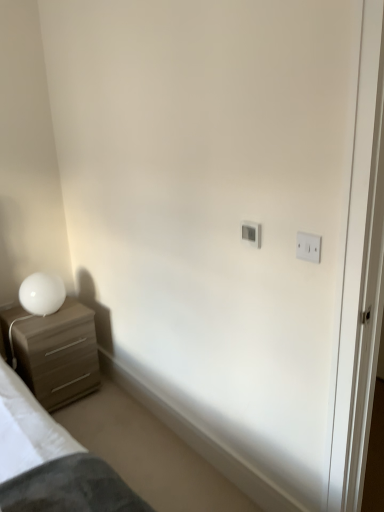
Question: Could you tell me if white plastic light switch at upper right, which is the 1th light switch from right to left, is facing matte wood chest of drawers at left?

Choices:
 (A) no
 (B) yes

Answer: (A)

Question: Can you confirm if white plastic light switch at upper right, which is the 1th light switch from right to left, is taller than matte wood chest of drawers at left?

Choices:
 (A) no
 (B) yes

Answer: (A)

Question: Does white plastic light switch at upper right, which is the 1th light switch from right to left, contain matte wood chest of drawers at left?

Choices:
 (A) yes
 (B) no

Answer: (B)

Question: Is white plastic light switch at upper right, placed as the first light switch when sorted from front to back, directly adjacent to matte wood chest of drawers at left?

Choices:
 (A) yes
 (B) no

Answer: (B)

Question: From the image's perspective, is white plastic light switch at upper right, which is the second light switch in left-to-right order, over matte wood chest of drawers at left?

Choices:
 (A) yes
 (B) no

Answer: (A)

Question: In terms of height, does white glossy table lamp at lower left look taller or shorter compared to white plastic light switch at upper center, the 1th light switch viewed from the back?

Choices:
 (A) tall
 (B) short

Answer: (A)

Question: Is white glossy table lamp at lower left spatially inside white plastic light switch at upper center, the second light switch when ordered from front to back, or outside of it?

Choices:
 (A) inside
 (B) outside

Answer: (B)

Question: Is white glossy table lamp at lower left wider or thinner than white plastic light switch at upper center, the 1th light switch viewed from the back?

Choices:
 (A) wide
 (B) thin

Answer: (A)

Question: Based on their positions, is white glossy table lamp at lower left located to the left or right of white plastic light switch at upper center, the second light switch when ordered from front to back?

Choices:
 (A) left
 (B) right

Answer: (A)

Question: Which is correct: matte wood chest of drawers at left is inside white glossy table lamp at lower left, or outside of it?

Choices:
 (A) outside
 (B) inside

Answer: (A)

Question: Is matte wood chest of drawers at left wider or thinner than white glossy table lamp at lower left?

Choices:
 (A) thin
 (B) wide

Answer: (B)

Question: From their relative heights in the image, would you say matte wood chest of drawers at left is taller or shorter than white glossy table lamp at lower left?

Choices:
 (A) tall
 (B) short

Answer: (A)

Question: In terms of size, does matte wood chest of drawers at left appear bigger or smaller than white glossy table lamp at lower left?

Choices:
 (A) big
 (B) small

Answer: (A)

Question: Considering the positions of white plastic light switch at upper center, marked as the first light switch in a left-to-right arrangement, and white glossy table lamp at lower left in the image, is white plastic light switch at upper center, marked as the first light switch in a left-to-right arrangement, taller or shorter than white glossy table lamp at lower left?

Choices:
 (A) tall
 (B) short

Answer: (B)

Question: From a real-world perspective, is white plastic light switch at upper center, acting as the 2th light switch starting from the right, physically located above or below white glossy table lamp at lower left?

Choices:
 (A) above
 (B) below

Answer: (A)